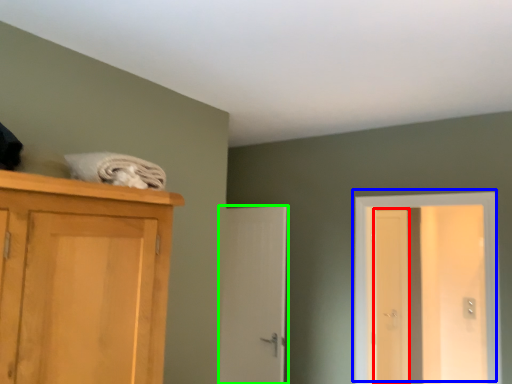
Question: Which is nearer to the screen door (highlighted by a red box)? door (highlighted by a blue box) or door (highlighted by a green box).

Choices:
 (A) door
 (B) door

Answer: (A)